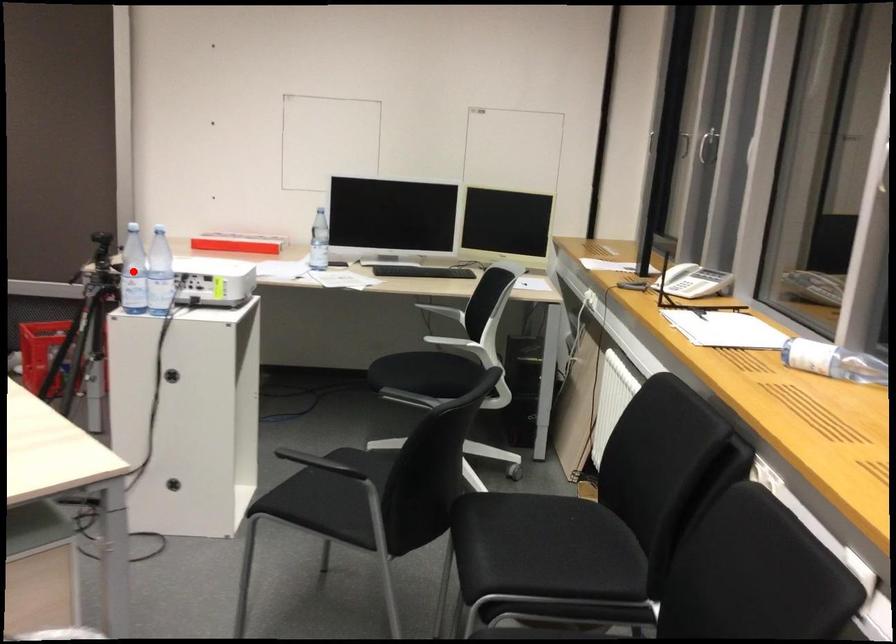
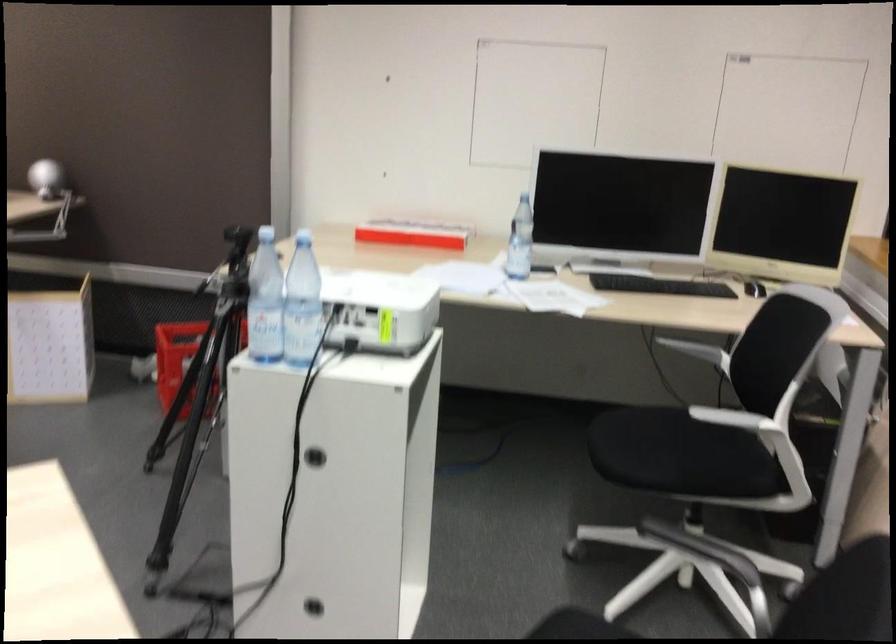
Where in the second image is the point corresponding to the highlighted location from the first image?

(264, 301)